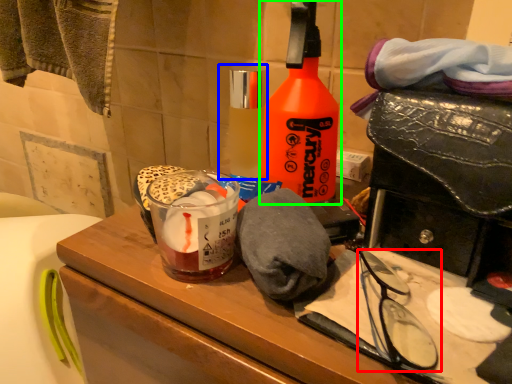
Question: Which object is positioned closest to glasses (highlighted by a red box)? Select from bottle (highlighted by a blue box) and bottle (highlighted by a green box).

Choices:
 (A) bottle
 (B) bottle

Answer: (B)